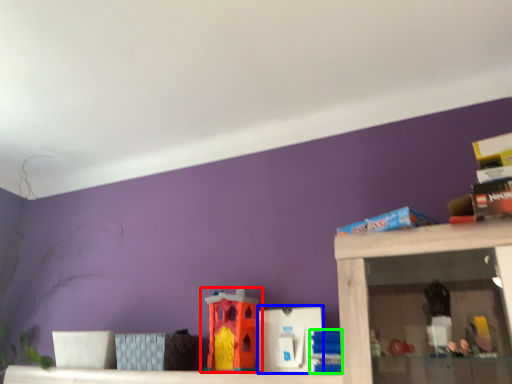
Question: Which object is positioned closest to toy (highlighted by a red box)? Select from toy (highlighted by a blue box) and toy (highlighted by a green box).

Choices:
 (A) toy
 (B) toy

Answer: (A)